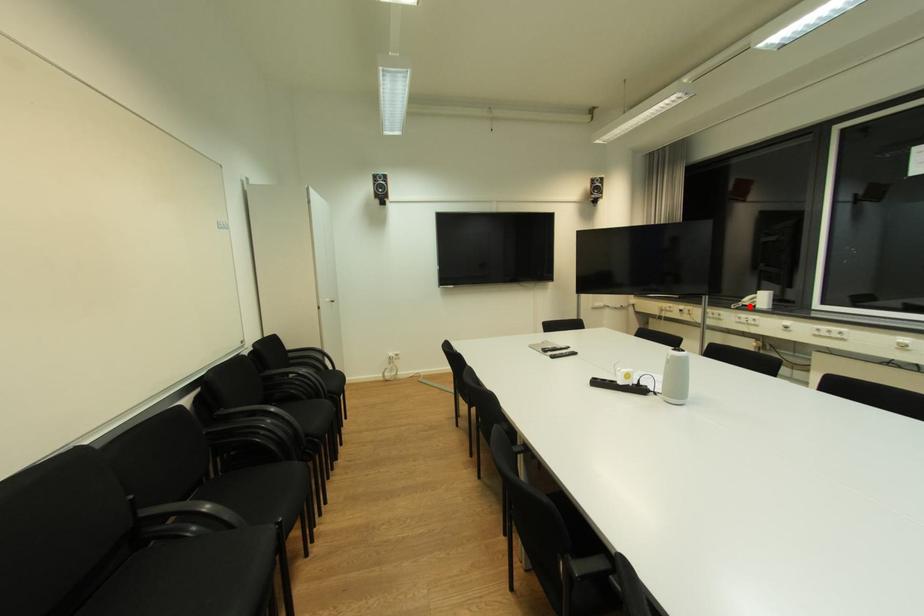
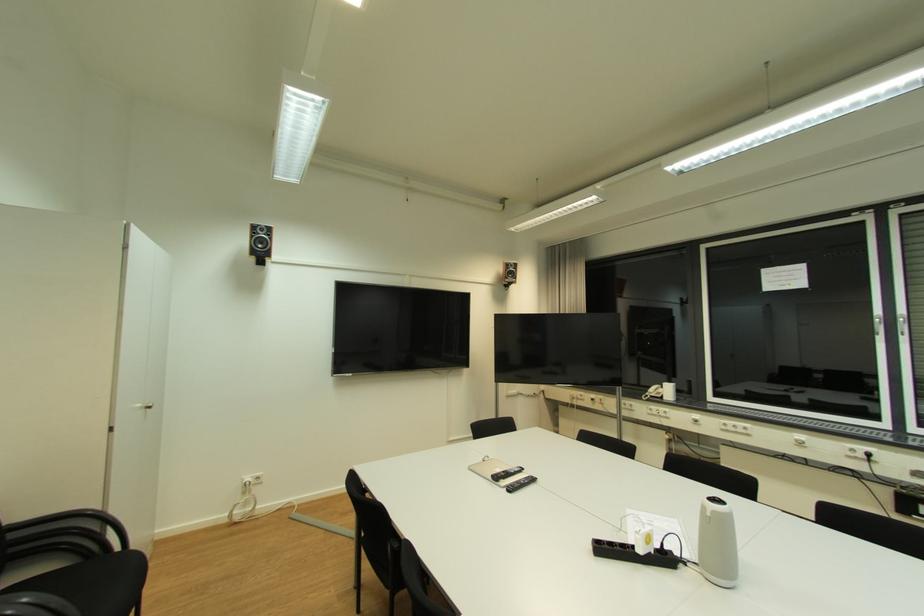
Find the pixel in the second image that matches the highlighted location in the first image.

(657, 397)